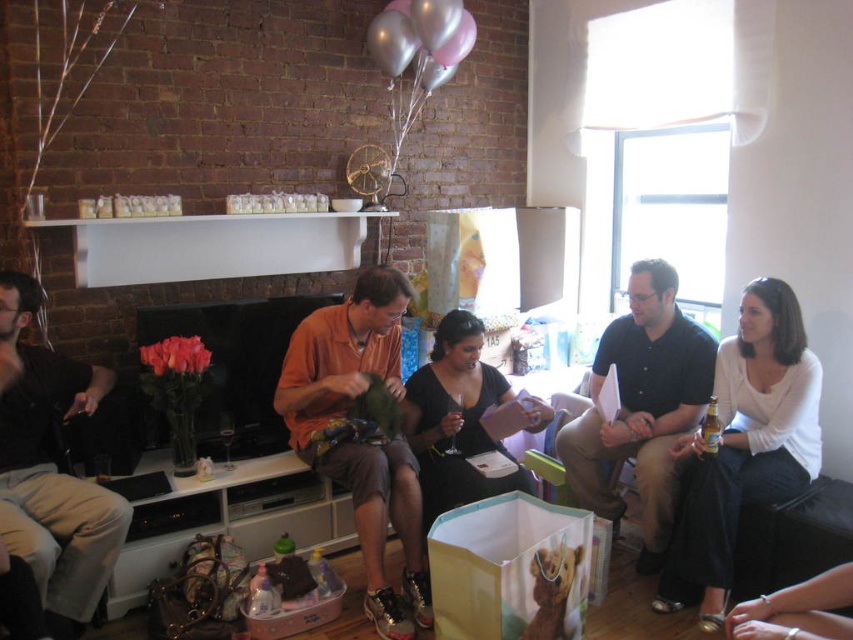
You are a photographer trying to capture a closeup of the smooth silver bracelet at lower right without including the matte black shirt at left in the frame. Given their sizes, is this feasible?

The matte black shirt at left is wider than the smooth silver bracelet at lower right. Since the shirt is wider, it might block the bracelet if positioned closely. However, since the bracelet is at lower right and the shirt is at left, adjusting the camera angle to focus solely on the bracelet could work, provided there is enough space between them.

You are standing in the living room and want to hand a gift to the person wearing the orange cotton shirt at center. There is a narrow path between the two people. Can you reach them without moving the person in white matte shirt at right?

The white matte shirt at right is to the right of the orange cotton shirt at center, so you can reach the orange cotton shirt at center without needing to move the white matte shirt at right as they are positioned side by side with the white one being on the right side.

You are a photographer positioned in the living room and want to capture a photo of both the white matte shirt at right and the smooth silver bracelet at lower right. Which object should you focus on first to ensure both are in clear focus?

The white matte shirt at right is closer to you than the smooth silver bracelet at lower right. To ensure both are in focus, you should focus on the white matte shirt at right first, as it is the closer object.